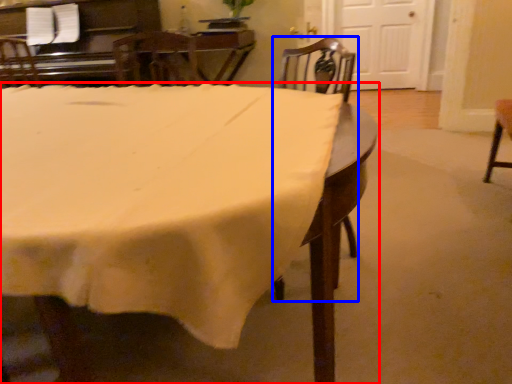
Question: Which of the following is the farthest to the observer, table (highlighted by a red box) or chair (highlighted by a blue box)?

Choices:
 (A) table
 (B) chair

Answer: (B)